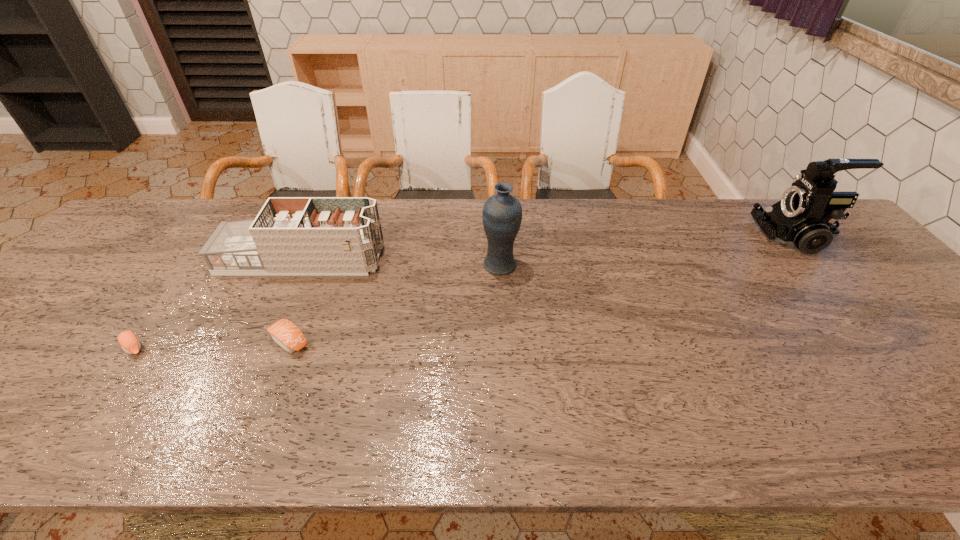
This screenshot has width=960, height=540. I want to click on the rightmost object, so click(803, 219).

Find the location of a particular element. This screenshot has height=540, width=960. the fourth object from left to right is located at coordinates (502, 213).

Locate an element on the screen. This screenshot has width=960, height=540. the third tallest object is located at coordinates (290, 235).

I want to click on the right sushi, so click(x=287, y=335).

You are a GUI agent. You are given a task and a screenshot of the screen. Output one action in this format:
    pyautogui.click(x=<x>, y=<y>)
    Task: Click on the fourth tallest object
    
    Given the screenshot: What is the action you would take?
    pyautogui.click(x=287, y=335)

The width and height of the screenshot is (960, 540). In order to click on the shortest object in this screenshot , I will do `click(129, 342)`.

You are a GUI agent. You are given a task and a screenshot of the screen. Output one action in this format:
    pyautogui.click(x=<x>, y=<y>)
    Task: Click on the left sushi
    
    Given the screenshot: What is the action you would take?
    pyautogui.click(x=129, y=342)

Where is `free space located on the lens mount of the rightmost object`? This screenshot has width=960, height=540. free space located on the lens mount of the rightmost object is located at coordinates (654, 236).

What are the coordinates of `free space located on the lens mount of the rightmost object` in the screenshot? It's located at (720, 236).

I want to click on vacant space situated on the lens mount of the rightmost object, so click(697, 236).